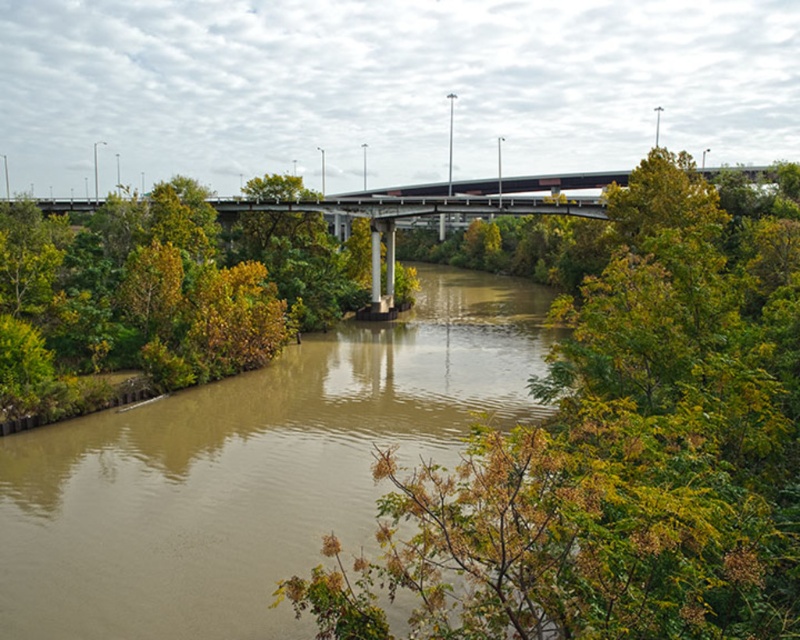
Is point (592, 522) closer to viewer compared to point (88, 588)?

Yes, point (592, 522) is in front of point (88, 588).

The height and width of the screenshot is (640, 800). What do you see at coordinates (618, 454) in the screenshot?
I see `green leafy tree at center` at bounding box center [618, 454].

Where is `green leafy tree at center`? green leafy tree at center is located at coordinates (618, 454).